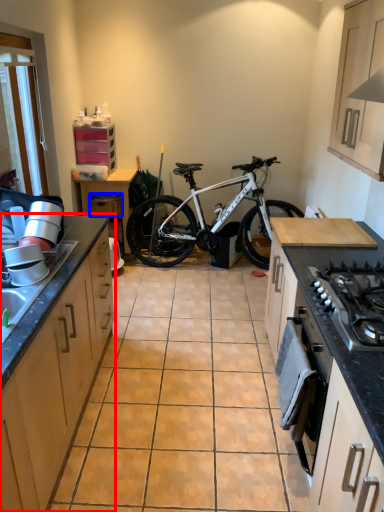
Question: Which object is closer to the camera taking this photo, cabinetry (highlighted by a red box) or drawer (highlighted by a blue box)?

Choices:
 (A) cabinetry
 (B) drawer

Answer: (A)